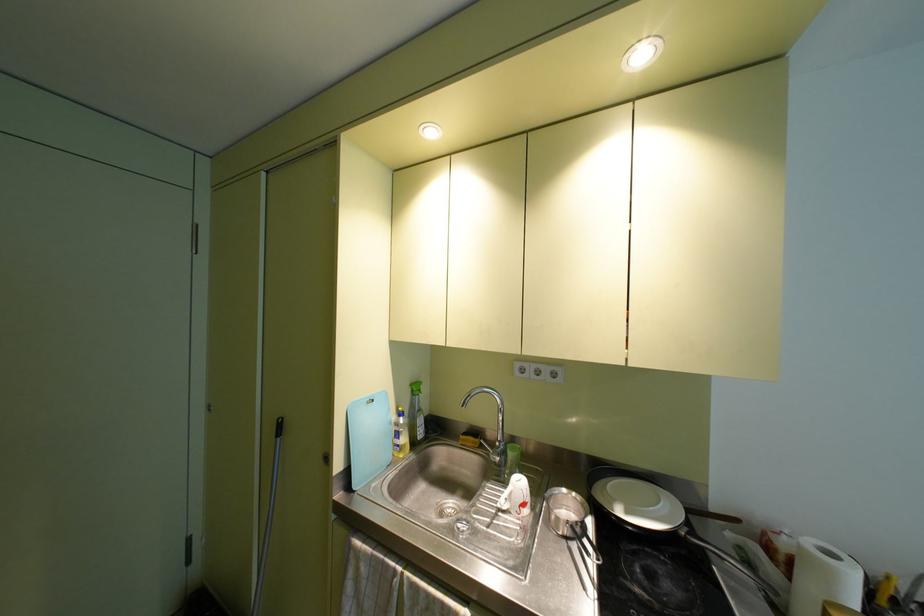
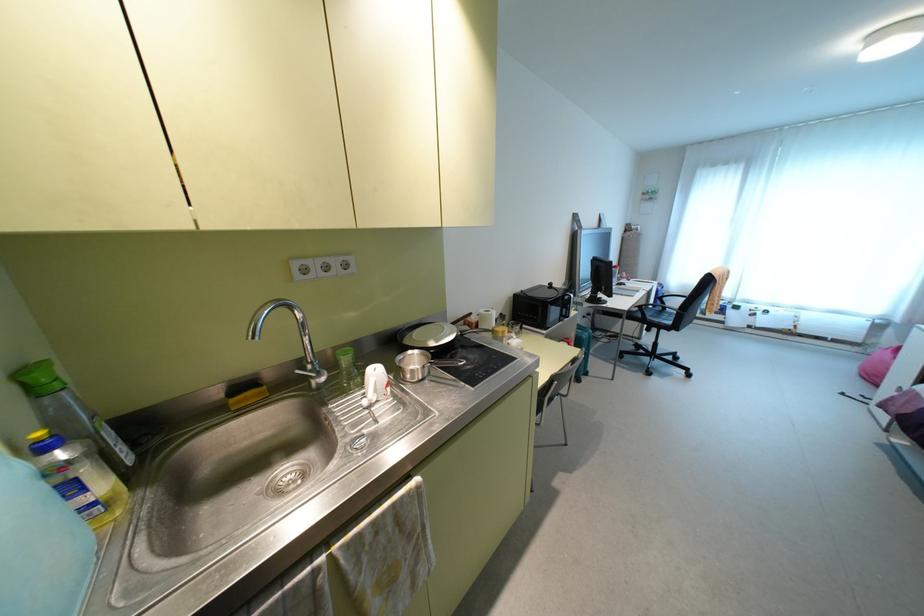
In the second image, find the point that corresponds to (399,413) in the first image.

(43, 447)